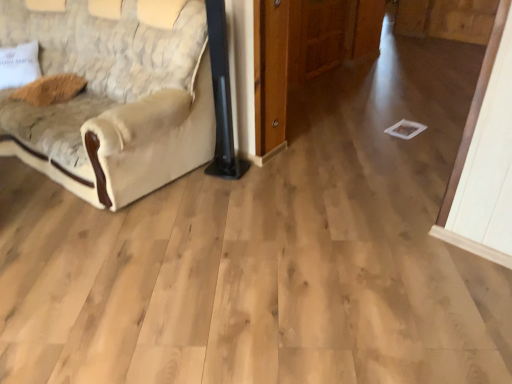
Question: From the image's perspective, is brown fuzzy pillow at upper left, the first pillow viewed from the right, over beige fabric couch at left?

Choices:
 (A) no
 (B) yes

Answer: (A)

Question: From the image's perspective, is brown fuzzy pillow at upper left, acting as the 2th pillow starting from the left, under beige fabric couch at left?

Choices:
 (A) yes
 (B) no

Answer: (A)

Question: Considering the relative sizes of brown fuzzy pillow at upper left, the first pillow viewed from the right, and beige fabric couch at left in the image provided, is brown fuzzy pillow at upper left, the first pillow viewed from the right, shorter than beige fabric couch at left?

Choices:
 (A) yes
 (B) no

Answer: (A)

Question: Is brown fuzzy pillow at upper left, the first pillow viewed from the right, thinner than beige fabric couch at left?

Choices:
 (A) yes
 (B) no

Answer: (A)

Question: Would you say beige fabric couch at left is part of brown fuzzy pillow at upper left, the first pillow viewed from the right,'s contents?

Choices:
 (A) no
 (B) yes

Answer: (A)

Question: Is brown fuzzy pillow at upper left, acting as the 2th pillow starting from the left, to the left of beige fabric couch at left from the viewer's perspective?

Choices:
 (A) no
 (B) yes

Answer: (B)

Question: Is the position of beige textured pillow at left, the second pillow in the right-to-left sequence, more distant than that of beige fabric couch at left?

Choices:
 (A) no
 (B) yes

Answer: (B)

Question: Is beige textured pillow at left, the second pillow in the right-to-left sequence, surrounding beige fabric couch at left?

Choices:
 (A) no
 (B) yes

Answer: (A)

Question: Can you confirm if beige textured pillow at left, the second pillow in the right-to-left sequence, is thinner than beige fabric couch at left?

Choices:
 (A) no
 (B) yes

Answer: (B)

Question: From a real-world perspective, is beige textured pillow at left, placed as the first pillow when sorted from left to right, positioned over beige fabric couch at left based on gravity?

Choices:
 (A) yes
 (B) no

Answer: (B)

Question: Is beige textured pillow at left, placed as the first pillow when sorted from left to right, outside of beige fabric couch at left?

Choices:
 (A) no
 (B) yes

Answer: (A)

Question: Considering the relative sizes of beige textured pillow at left, the second pillow in the right-to-left sequence, and beige fabric couch at left in the image provided, is beige textured pillow at left, the second pillow in the right-to-left sequence, taller than beige fabric couch at left?

Choices:
 (A) yes
 (B) no

Answer: (B)

Question: From a real-world perspective, is beige fabric couch at left physically below brown fuzzy pillow at upper left, acting as the 2th pillow starting from the left?

Choices:
 (A) yes
 (B) no

Answer: (B)